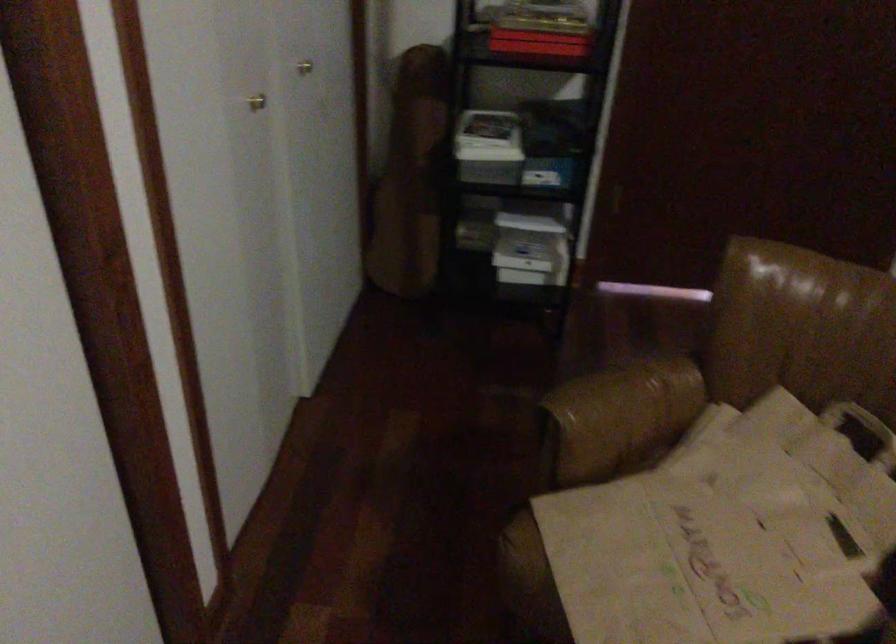
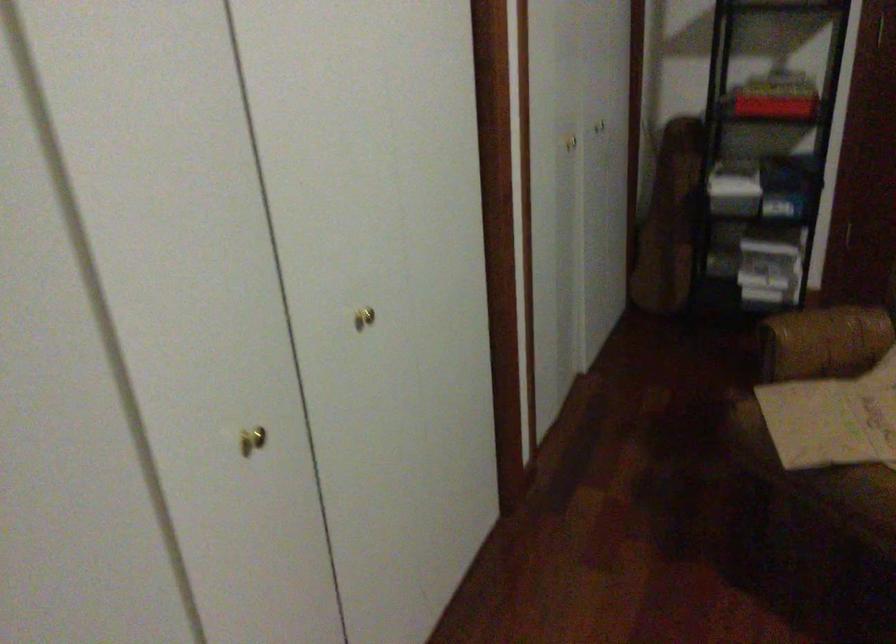
Question: How did the camera likely rotate?

Choices:
 (A) Left
 (B) Right
 (C) Up
 (D) Down

Answer: (A)